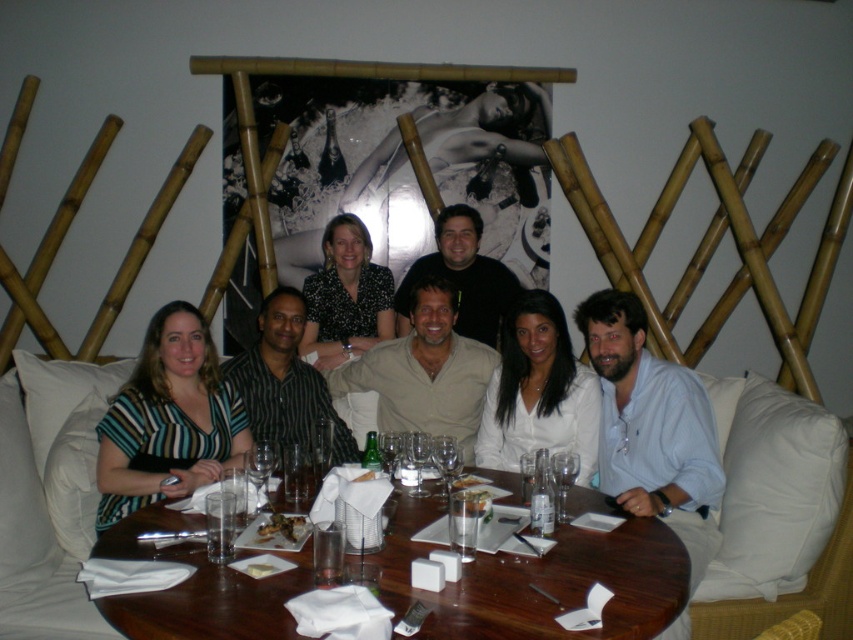
Question: From the image, what is the correct spatial relationship of striped fabric shirt at left in relation to white glossy shirt at center?

Choices:
 (A) below
 (B) above

Answer: (A)

Question: Which is farther from the transparent glass wine glass at table center?

Choices:
 (A) black dotted blouse at center
 (B) white glossy shirt at center
 (C) striped fabric shirt at center
 (D) striped fabric shirt at left

Answer: (A)

Question: Which object appears closest to the camera in this image?

Choices:
 (A) wooden at center
 (B) black dotted blouse at center

Answer: (A)

Question: Is white glossy shirt at center to the right of transparent glass wine glass at table center from the viewer's perspective?

Choices:
 (A) no
 (B) yes

Answer: (B)

Question: Can you confirm if striped fabric shirt at left is bigger than black dotted blouse at center?

Choices:
 (A) yes
 (B) no

Answer: (A)

Question: Which object appears closest to the camera in this image?

Choices:
 (A) striped fabric shirt at center
 (B) black dotted blouse at center

Answer: (A)